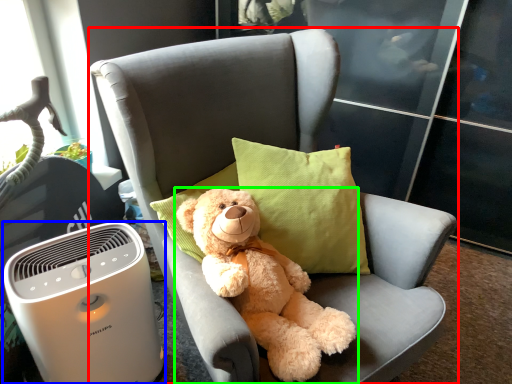
Question: Based on their relative distances, which object is farther from chair (highlighted by a red box)? Choose from home appliance (highlighted by a blue box) and teddy bear (highlighted by a green box).

Choices:
 (A) home appliance
 (B) teddy bear

Answer: (A)